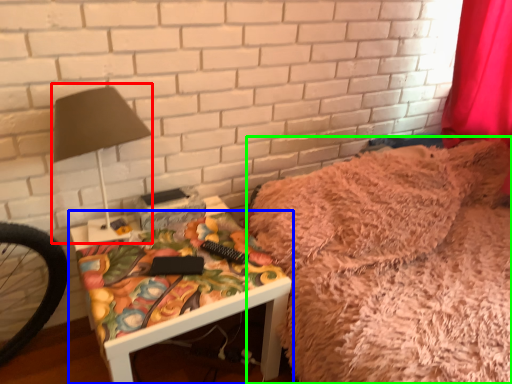
Question: Which is nearer to the table lamp (highlighted by a red box)? furniture (highlighted by a blue box) or bed (highlighted by a green box).

Choices:
 (A) furniture
 (B) bed

Answer: (A)